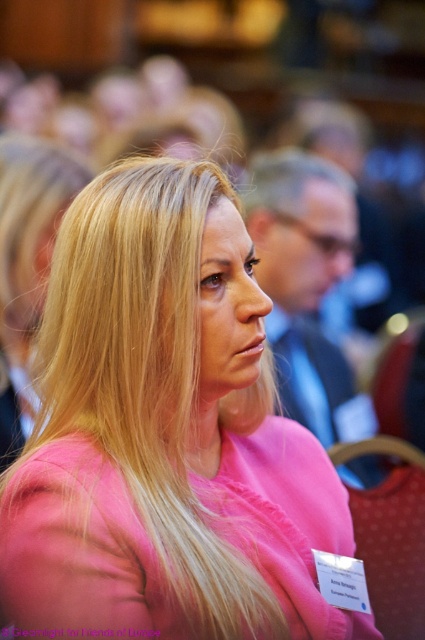
What is the position of the pink matte shirt at center in the image?

The pink matte shirt at center is located at point [164,435].

Based on the photo, you are standing at the point labeled point (193, 548) in the image. You want to take a photo of the woman in the pink top with your smartphone, which has a maximum autofocus range of 1.2 meters. Will the woman be in focus?

The distance between point (193, 548) and the camera is 1.15 meters, which is within the smartphone camera maximum autofocus range of 1.2 meters. Therefore, the woman will be in focus.

You are organizing a photoshoot and need to choose between two shirts for the model. The pink matte shirt at center and the pink fabric shirt at center are options. Based on the image, which shirt would be better if you want the model to stand out more due to its visual presence?

The pink fabric shirt at center would be better because it occupies more space than the pink matte shirt at center, making it more visually prominent.